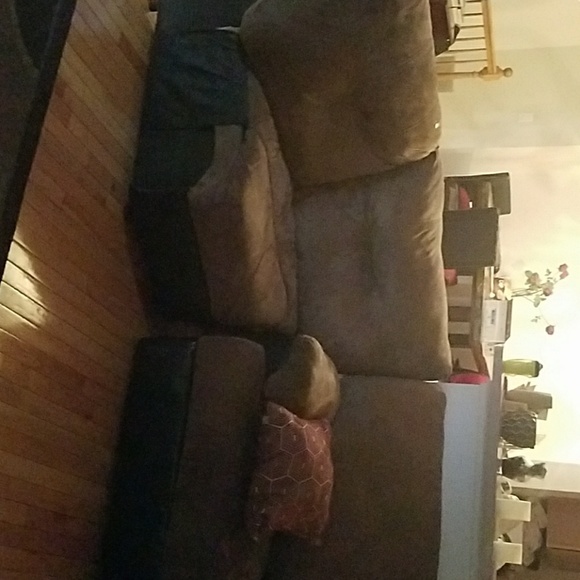
Locate an element on the screen. counter is located at coordinates (488, 470).